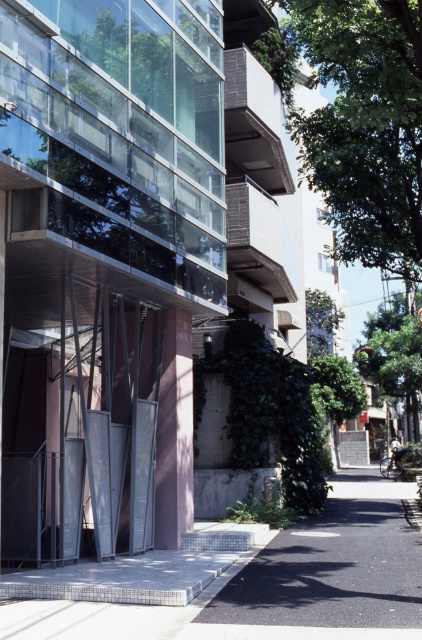
Question: Is green leafy tree at center above green leafy tree at right?

Choices:
 (A) no
 (B) yes

Answer: (B)

Question: Is gray concrete pavement at lower center bigger than green leafy tree at center?

Choices:
 (A) yes
 (B) no

Answer: (B)

Question: Which object appears farthest from the camera in this image?

Choices:
 (A) green leafy tree at center
 (B) green leafy tree at right
 (C) gray concrete pavement at lower center

Answer: (B)

Question: Does green leafy tree at center have a greater width compared to green leafy tree at right?

Choices:
 (A) no
 (B) yes

Answer: (B)

Question: Which object appears farthest from the camera in this image?

Choices:
 (A) green leafy tree at center
 (B) green leafy tree at right

Answer: (B)

Question: Which of these objects is positioned farthest from the green leafy tree at center?

Choices:
 (A) green leafy tree at right
 (B) gray concrete pavement at lower center

Answer: (A)